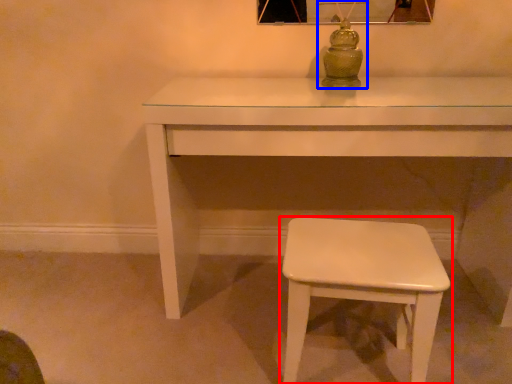
Question: Which point is closer to the camera, stool (highlighted by a red box) or table lamp (highlighted by a blue box)?

Choices:
 (A) stool
 (B) table lamp

Answer: (A)